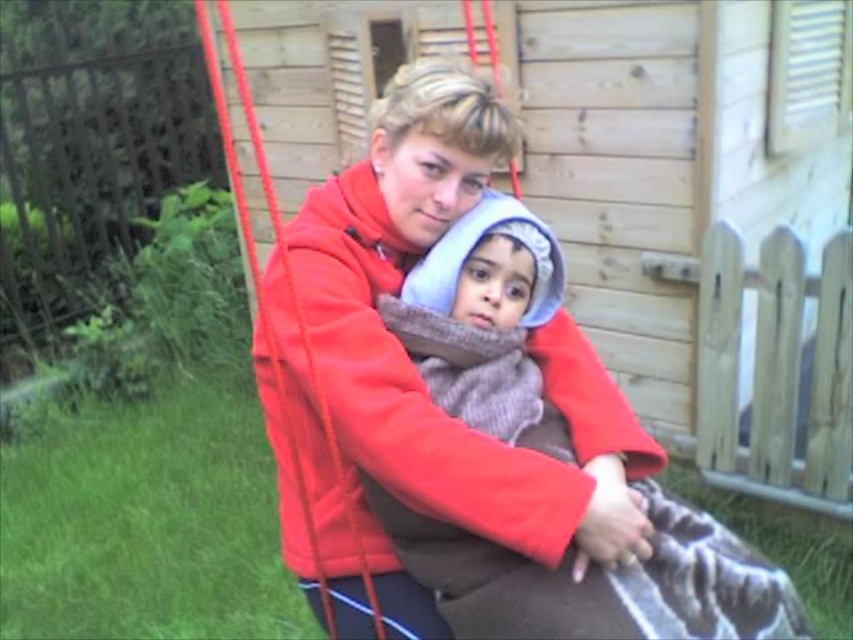
Question: Does matte fleece jacket at center appear under knitted wool scarf at center?

Choices:
 (A) yes
 (B) no

Answer: (B)

Question: Where is matte fleece jacket at center located in relation to knitted wool scarf at center in the image?

Choices:
 (A) right
 (B) left

Answer: (B)

Question: Is matte fleece jacket at center closer to the viewer compared to knitted wool scarf at center?

Choices:
 (A) yes
 (B) no

Answer: (B)

Question: Which point is closer to the camera?

Choices:
 (A) (672, 625)
 (B) (331, 577)

Answer: (A)